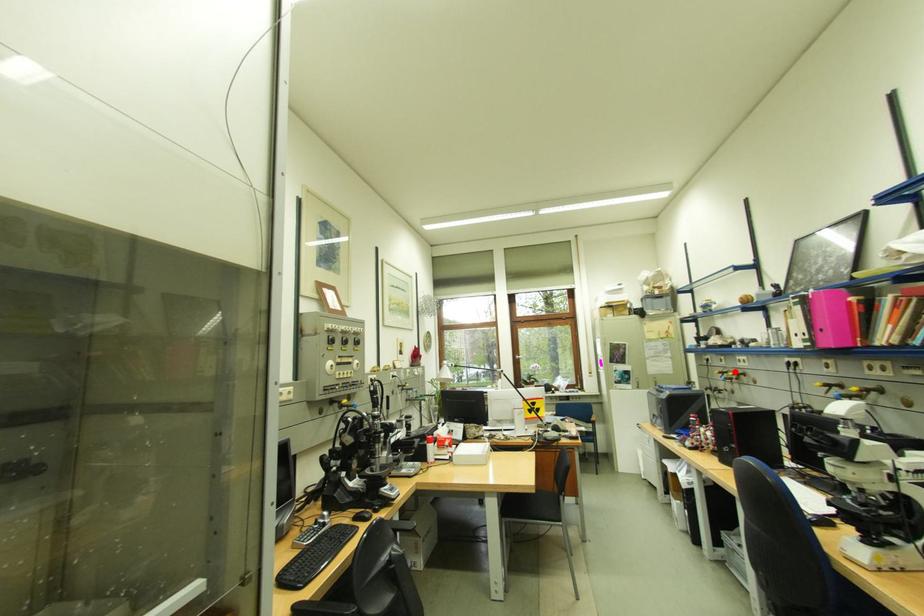
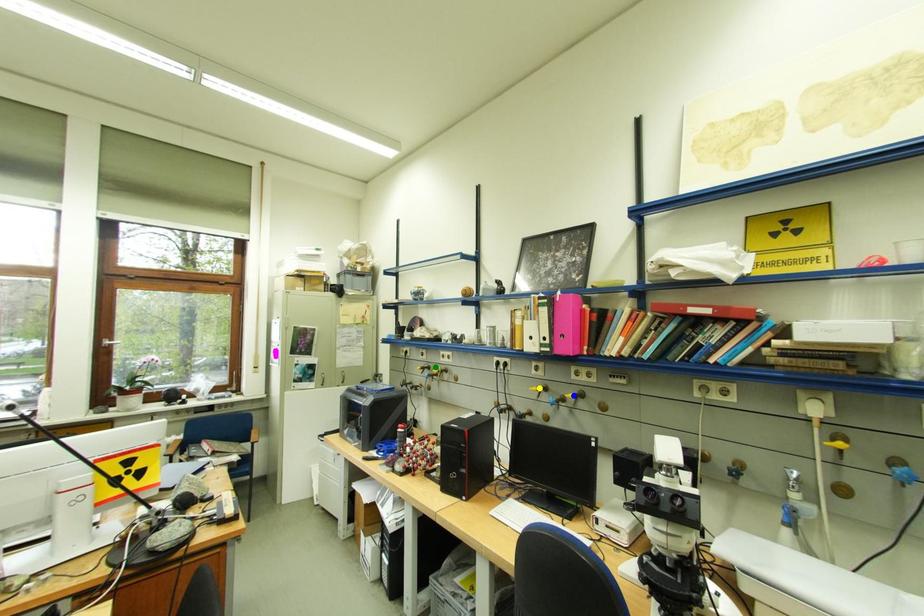
Question: I am providing you with two images of the same scene from different viewpoints. A red point is marked on the first image. You are given multiple points on the second image. Which point in image 2 represents the same 3d spot as the red point in image 1?

Choices:
 (A) green point
 (B) blue point
 (C) yellow point

Answer: (A)